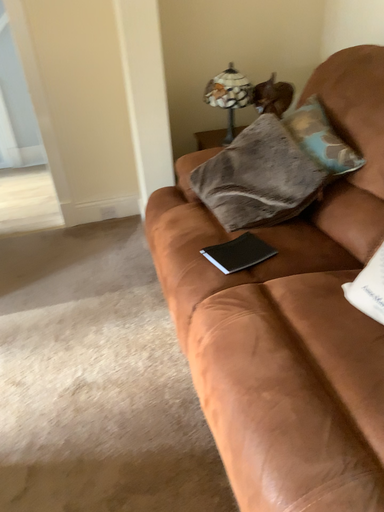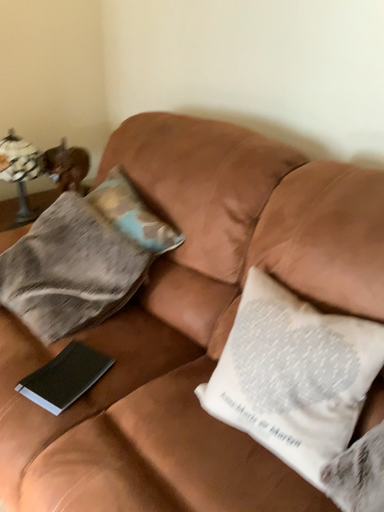
Question: Which way did the camera rotate in the video?

Choices:
 (A) rotated upward
 (B) rotated downward

Answer: (A)